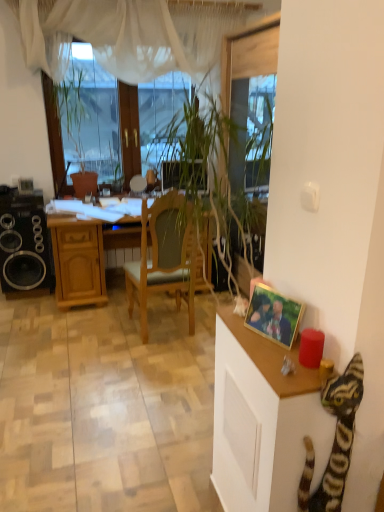
Question: Is the position of gold-framed photo at right more distant than that of striped plush cat at lower right?

Choices:
 (A) yes
 (B) no

Answer: (A)

Question: Can you see gold-framed photo at right touching striped plush cat at lower right?

Choices:
 (A) no
 (B) yes

Answer: (A)

Question: Does gold-framed photo at right have a lesser height compared to striped plush cat at lower right?

Choices:
 (A) no
 (B) yes

Answer: (B)

Question: Does gold-framed photo at right have a greater width compared to striped plush cat at lower right?

Choices:
 (A) no
 (B) yes

Answer: (A)

Question: Is gold-framed photo at right located outside striped plush cat at lower right?

Choices:
 (A) yes
 (B) no

Answer: (A)

Question: From a real-world perspective, is gold-framed photo at right under striped plush cat at lower right?

Choices:
 (A) yes
 (B) no

Answer: (B)

Question: From a real-world perspective, does wooden cabinet at right sit lower than gold-framed photo at right?

Choices:
 (A) no
 (B) yes

Answer: (B)

Question: Does wooden cabinet at right have a lesser height compared to gold-framed photo at right?

Choices:
 (A) no
 (B) yes

Answer: (A)

Question: Is gold-framed photo at right surrounded by wooden cabinet at right?

Choices:
 (A) no
 (B) yes

Answer: (A)

Question: Does wooden cabinet at right appear on the left side of gold-framed photo at right?

Choices:
 (A) no
 (B) yes

Answer: (B)

Question: From a real-world perspective, is wooden cabinet at right over gold-framed photo at right?

Choices:
 (A) no
 (B) yes

Answer: (A)

Question: Is the depth of wooden cabinet at right greater than that of gold-framed photo at right?

Choices:
 (A) yes
 (B) no

Answer: (B)

Question: Is gold-framed photo at right touching wooden desk at center?

Choices:
 (A) no
 (B) yes

Answer: (A)